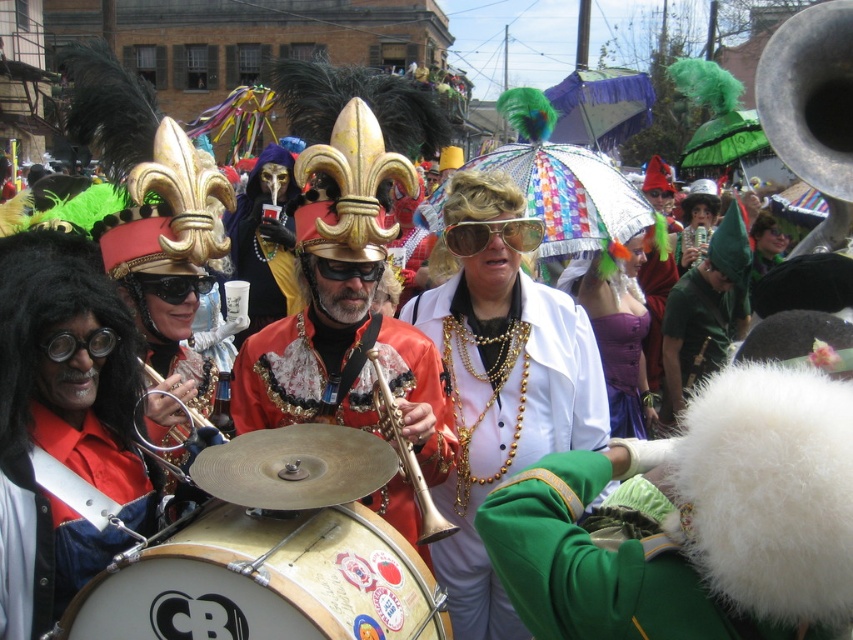
Question: Which of the following is the farthest from the observer?

Choices:
 (A) (456, 280)
 (B) (422, 513)

Answer: (A)

Question: Can you confirm if shiny gold sunglasses at center is thinner than gold metallic drum at center?

Choices:
 (A) yes
 (B) no

Answer: (A)

Question: Which object is closer to the camera taking this photo?

Choices:
 (A) shiny gold sunglasses at center
 (B) gold brass trumpet at center
 (C) gold metallic drum at center

Answer: (C)

Question: Considering the real-world distances, which object is farthest from the shiny gold sunglasses at center?

Choices:
 (A) gold reflective sunglasses at center
 (B) gold brass trumpet at center

Answer: (B)

Question: Is the position of shiny gold sunglasses at center more distant than that of gold reflective sunglasses at center?

Choices:
 (A) no
 (B) yes

Answer: (A)

Question: Can you confirm if shiny gold sunglasses at center is positioned to the left of gold metallic drum at center?

Choices:
 (A) yes
 (B) no

Answer: (B)